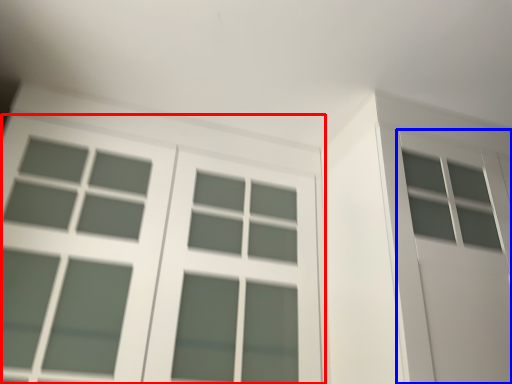
Question: Which point is further to the camera, window (highlighted by a red box) or screen door (highlighted by a blue box)?

Choices:
 (A) window
 (B) screen door

Answer: (B)